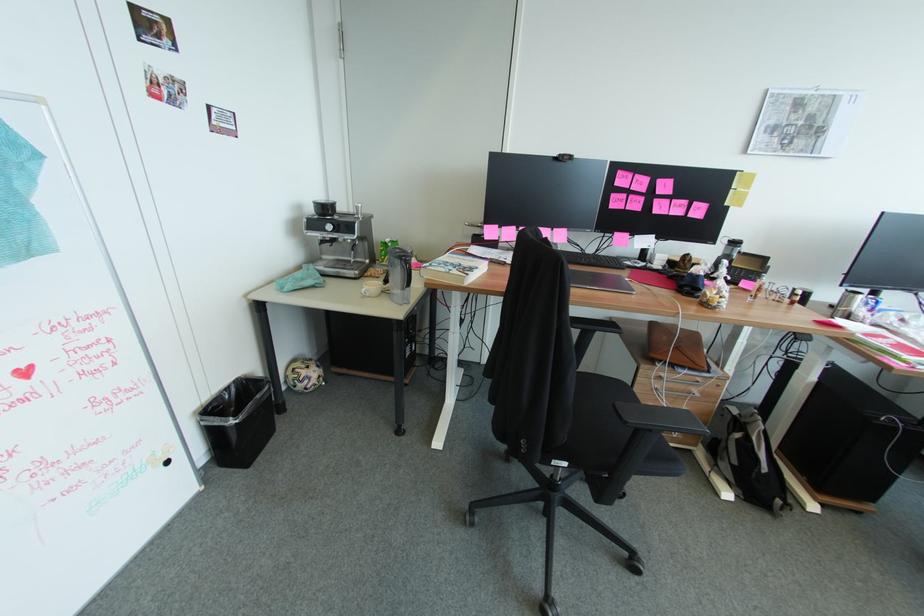
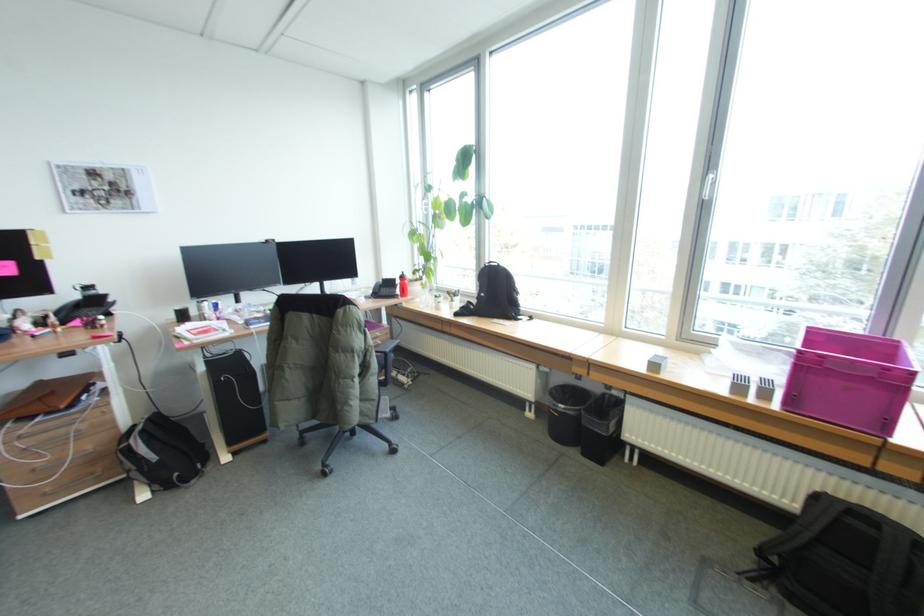
The point at (754,439) is marked in the first image. Where is the corresponding point in the second image?

(135, 444)